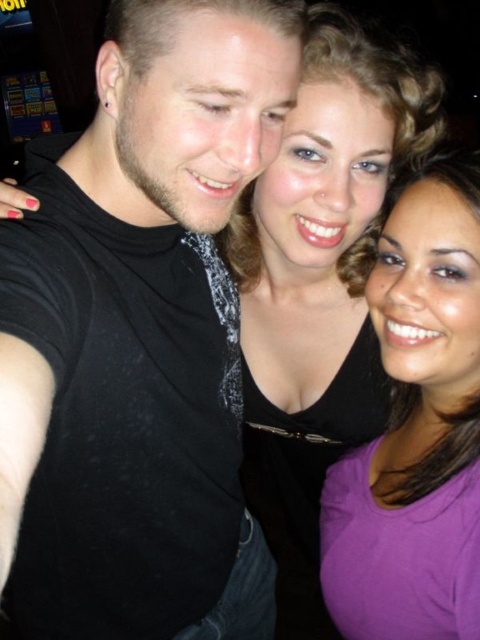
Question: Which object is closer to the camera taking this photo?

Choices:
 (A) black matte shirt at left
 (B) purple matte shirt at center
 (C) matte black top at center

Answer: (A)

Question: Among these points, which one is farthest from the camera?

Choices:
 (A) (387, 269)
 (B) (94, 243)
 (C) (358, 424)

Answer: (C)

Question: Does black matte shirt at left appear on the left side of matte black top at center?

Choices:
 (A) yes
 (B) no

Answer: (A)

Question: Which point is farther to the camera?

Choices:
 (A) purple matte shirt at center
 (B) black matte shirt at left

Answer: (A)

Question: Observing the image, what is the correct spatial positioning of black matte shirt at left in reference to purple matte shirt at center?

Choices:
 (A) above
 (B) below

Answer: (B)

Question: Does black matte shirt at left lie in front of matte black top at center?

Choices:
 (A) no
 (B) yes

Answer: (B)